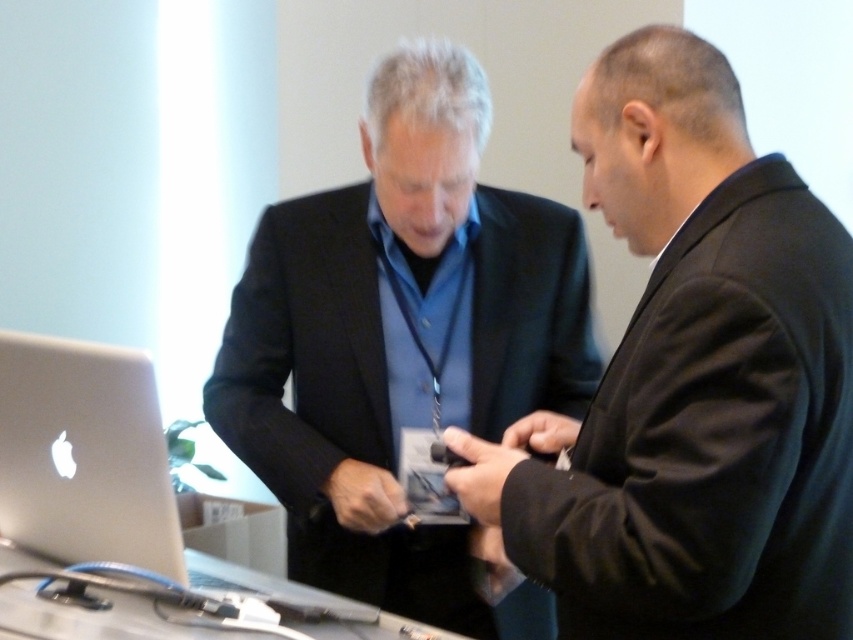
Question: Is silver metallic laptop at lower left bigger than metallic gray table at lower center?

Choices:
 (A) no
 (B) yes

Answer: (B)

Question: Which of the following is the closest to the observer?

Choices:
 (A) black matte suit at center
 (B) silver metallic laptop at lower left
 (C) metallic gray table at lower center
 (D) matte black suit at center

Answer: (A)

Question: Is black matte suit at center positioned at the back of metallic gray table at lower center?

Choices:
 (A) yes
 (B) no

Answer: (B)

Question: Is matte black suit at center further to the viewer compared to metallic gray table at lower center?

Choices:
 (A) no
 (B) yes

Answer: (B)

Question: Which of these objects is positioned closest to the metallic gray table at lower center?

Choices:
 (A) matte black suit at center
 (B) black matte suit at center
 (C) silver metallic laptop at lower left

Answer: (C)

Question: Which of the following is the closest to the observer?

Choices:
 (A) (844, 620)
 (B) (167, 637)
 (C) (136, 449)
 (D) (274, 390)

Answer: (A)